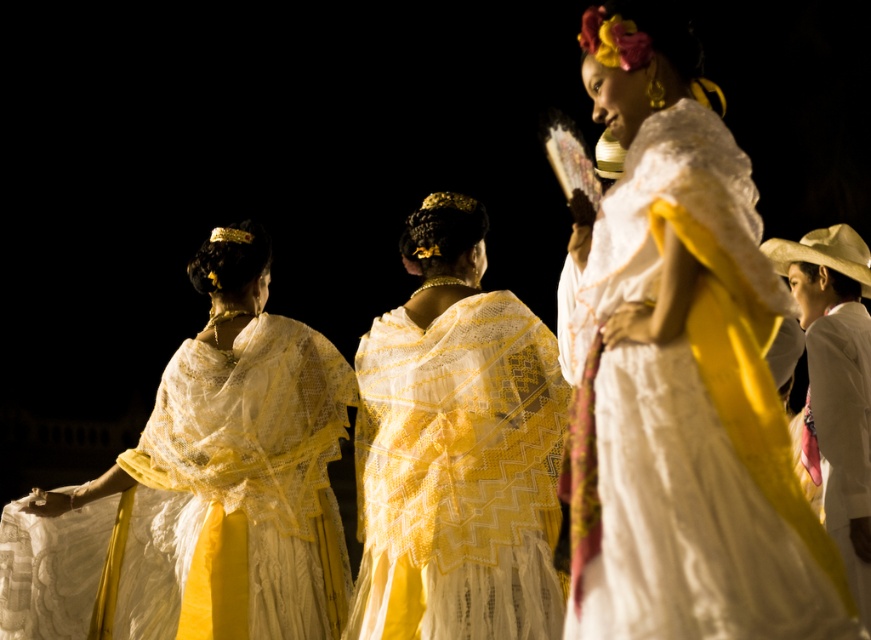
Can you confirm if matte white dress at center is thinner than matte white lace shawl at upper left?

Indeed, matte white dress at center has a lesser width compared to matte white lace shawl at upper left.

Where is `matte white dress at center`? The height and width of the screenshot is (640, 871). matte white dress at center is located at coordinates (680, 372).

Locate an element on the screen. matte white dress at center is located at coordinates (680, 372).

Is point (467, 256) farther from viewer compared to point (868, 500)?

No, it is not.

Which is above, white lace dress at center or white satin robe at right?

white lace dress at center is higher up.

Where is `white lace dress at center`? white lace dress at center is located at coordinates (456, 449).

Find the location of a particular element. This screenshot has width=871, height=640. white lace dress at center is located at coordinates (456, 449).

Can you confirm if matte white dress at center is wider than white satin robe at right?

No.

Locate an element on the screen. The image size is (871, 640). matte white dress at center is located at coordinates (680, 372).